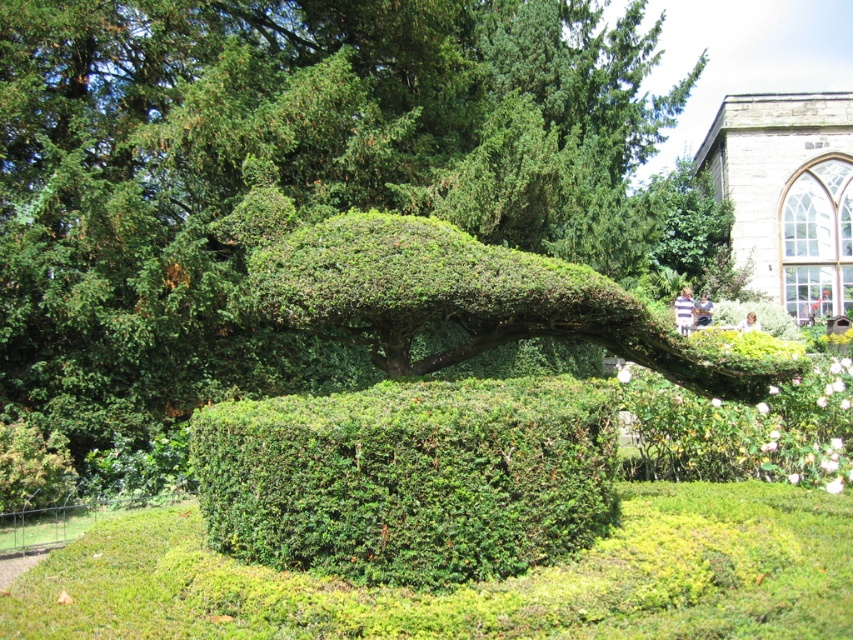
You are standing in the garden and want to take a photo of the green leafy bush at center. If your camera can focus on objects up to 15 feet away, will you need to move closer or farther away to capture a clear image?

The green leafy bush at center is 16.92 feet away, which is beyond the camera focus range of 15 feet. You need to move closer to ensure it is within the focus range.

You are a gardener who needs to decide which plant to prune first. Based on the garden scene, which of the two plants, the green leafy bush at center or the green leafy hedge at center, requires more frequent pruning due to its size?

The green leafy bush at center requires more frequent pruning because it is larger in size than the green leafy hedge at center.

You are standing at the center of the garden and want to locate the green leafy bush at center. Which direction should you look to find it?

The green leafy bush at center is located at point coordinates of [292,179], so you should look directly in front of you since it is centered in the garden.